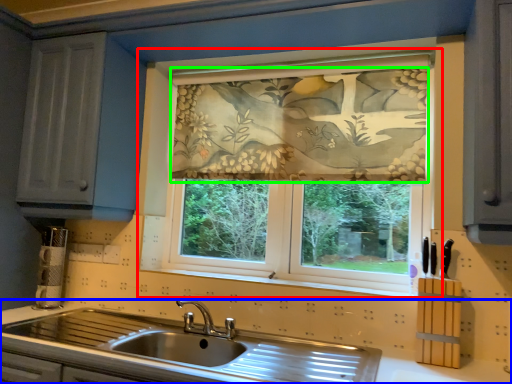
Question: Estimate the real-world distances between objects in this image. Which object is closer to window (highlighted by a red box), countertop (highlighted by a blue box) or curtain (highlighted by a green box)?

Choices:
 (A) countertop
 (B) curtain

Answer: (B)